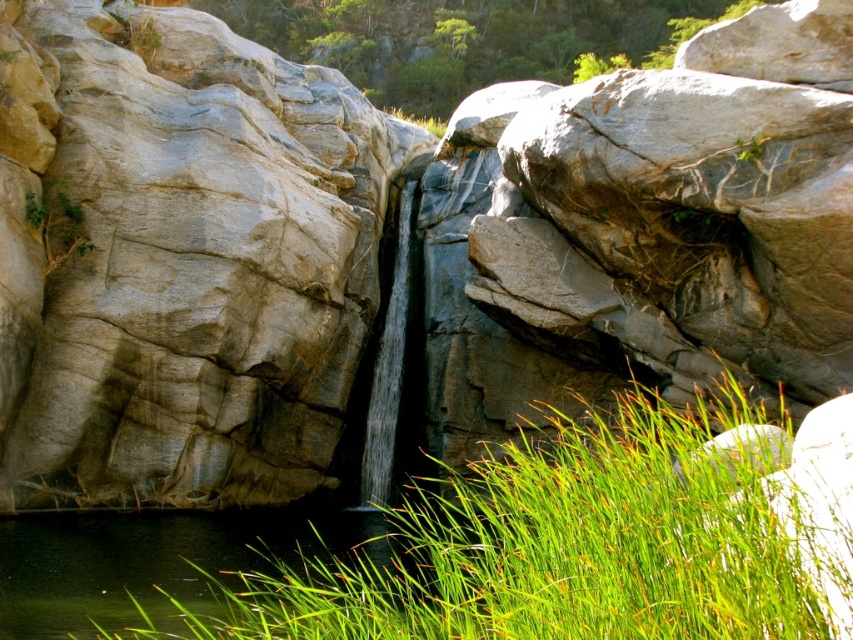
Question: Which object appears farthest from the camera in this image?

Choices:
 (A) green grass at center
 (B) green grass at upper center
 (C) clear water at center
 (D) green grassy water at lower left

Answer: (B)

Question: Which point is closer to the camera?

Choices:
 (A) (345, 67)
 (B) (587, 588)
 (C) (405, 234)

Answer: (B)

Question: From the image, what is the correct spatial relationship of green grassy water at lower left in relation to clear water at center?

Choices:
 (A) below
 (B) above

Answer: (A)

Question: Can you confirm if green grassy water at lower left is positioned to the right of clear water at center?

Choices:
 (A) yes
 (B) no

Answer: (B)

Question: Which point is farther from the camera taking this photo?

Choices:
 (A) (370, 419)
 (B) (593, 67)
 (C) (718, 499)

Answer: (B)

Question: Does green grass at upper center come in front of green grassy water at lower left?

Choices:
 (A) no
 (B) yes

Answer: (A)